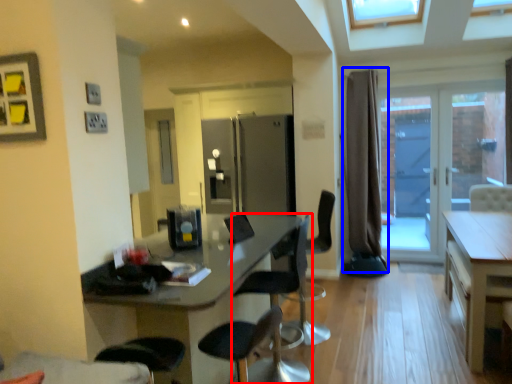
Question: Among these objects, which one is nearest to the camera, chair (highlighted by a red box) or curtain (highlighted by a blue box)?

Choices:
 (A) chair
 (B) curtain

Answer: (A)